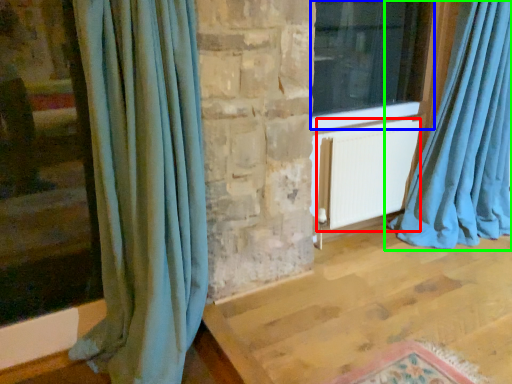
Question: Based on their relative distances, which object is nearer to radiator (highlighted by a red box)? Choose from window (highlighted by a blue box) and curtain (highlighted by a green box).

Choices:
 (A) window
 (B) curtain

Answer: (B)